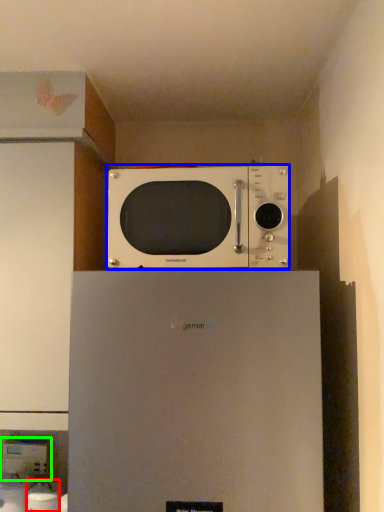
Question: Considering the real-world distances, which object is farthest from appliance (highlighted by a red box)? microwave oven (highlighted by a blue box) or appliance (highlighted by a green box)?

Choices:
 (A) microwave oven
 (B) appliance

Answer: (A)